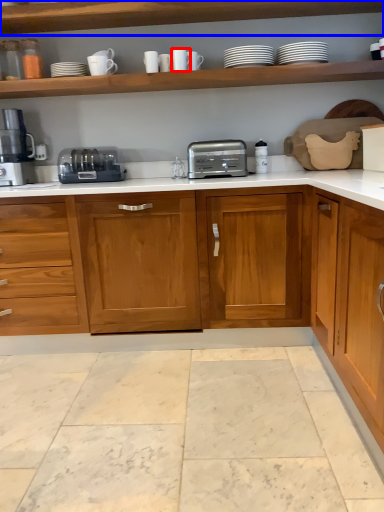
Question: Which of the following is the farthest to the observer, tableware (highlighted by a red box) or shelf (highlighted by a blue box)?

Choices:
 (A) tableware
 (B) shelf

Answer: (A)